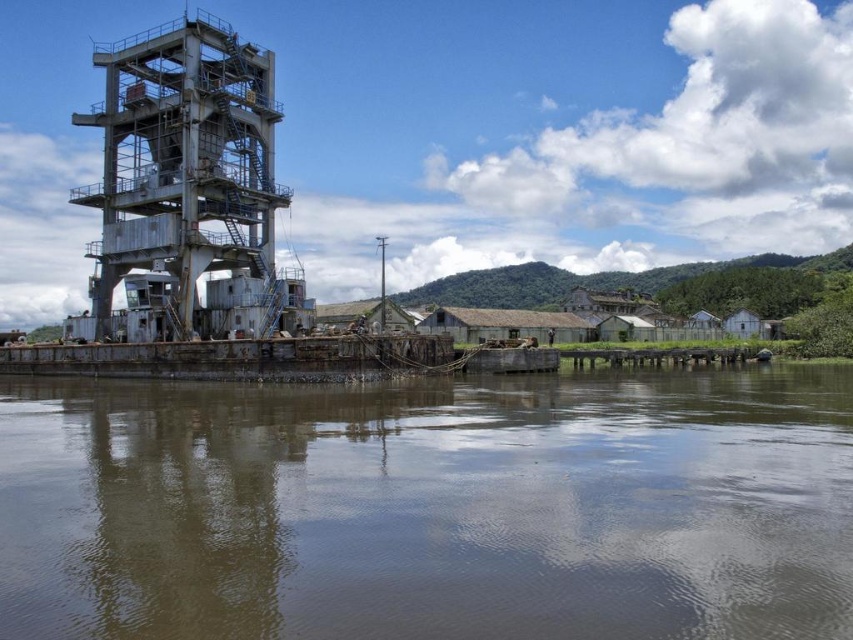
You are a safety inspector checking the industrial site. You notice the brown murky water at lower center and the rusty metal tower at left. Based on their positions, which object is closer to the right edge of the image?

The brown murky water at lower center is to the right of the rusty metal tower at left, so it is closer to the right edge of the image.

You are a worker at the port and need to cross from the rusty metal tower at left to the brown murky water at lower center. Which object is closer to you when you start at the tower?

The brown murky water at lower center is closer to you than the rusty metal tower at left since it has a smaller size compared to the tower.